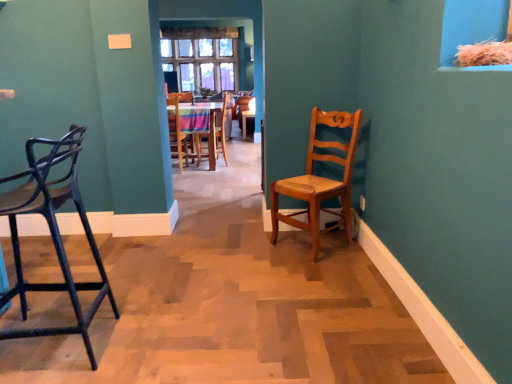
Identify the location of vacant area on the back side of matte black stool at left, the 5th chair viewed from the back. The image size is (512, 384). (113, 285).